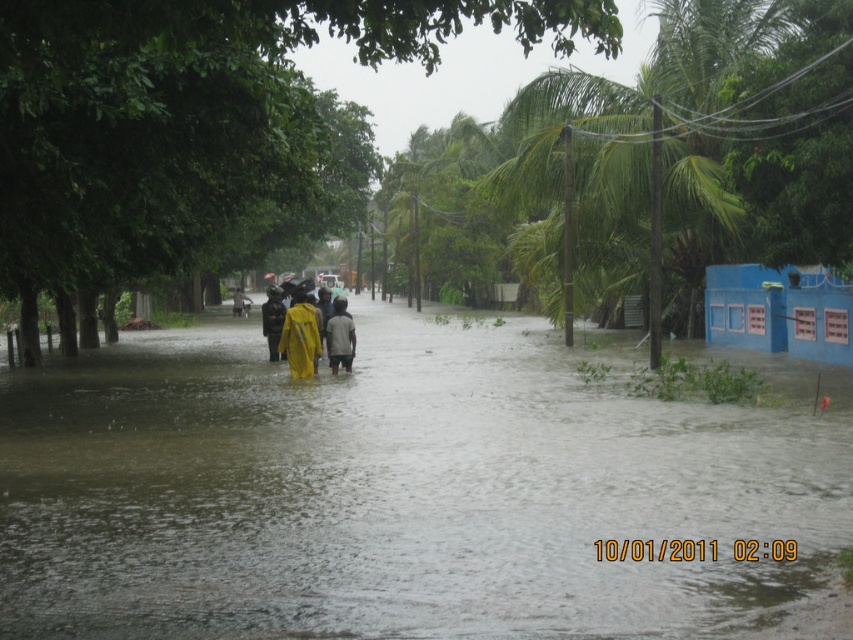
You are a pedestrian trying to cross the flooded street. You notice the brown murky water at center and the yellow matte raincoat at center. Which object is positioned to the right of the other?

The brown murky water at center is to the right of the yellow matte raincoat at center according to the description.